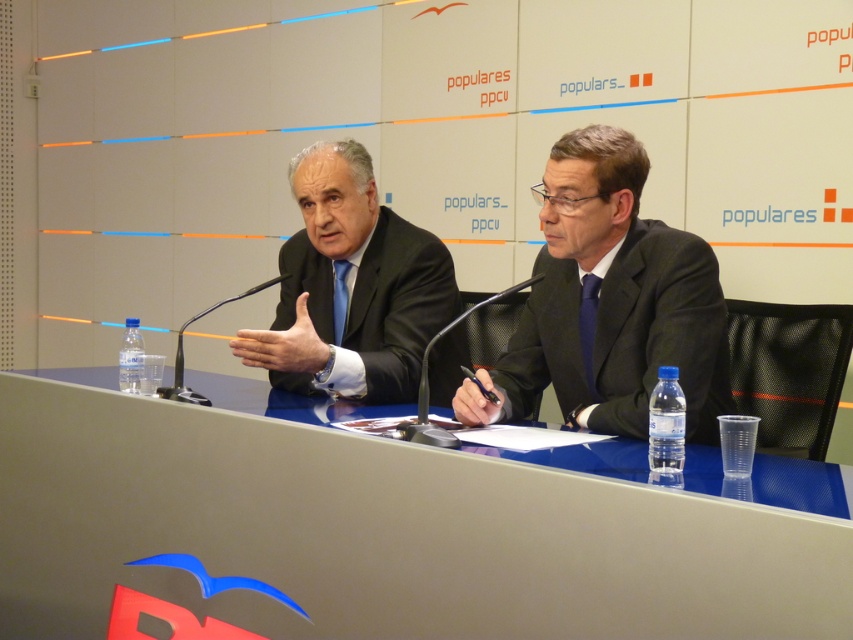
Question: Which object is positioned closest to the black matte suit at center?

Choices:
 (A) dark gray suit at center
 (B) blue glossy table at center

Answer: (B)

Question: Is blue glossy table at center closer to the viewer compared to black matte suit at center?

Choices:
 (A) yes
 (B) no

Answer: (A)

Question: Where is blue glossy table at center located in relation to dark gray suit at center in the image?

Choices:
 (A) above
 (B) below

Answer: (B)

Question: Can you confirm if dark gray suit at center is wider than black matte suit at center?

Choices:
 (A) no
 (B) yes

Answer: (B)

Question: Which point appears farthest from the camera in this image?

Choices:
 (A) pos(415,262)
 (B) pos(643,246)

Answer: (A)

Question: Based on their relative distances, which object is nearer to the black matte suit at center?

Choices:
 (A) blue glossy table at center
 (B) dark gray suit at center

Answer: (A)